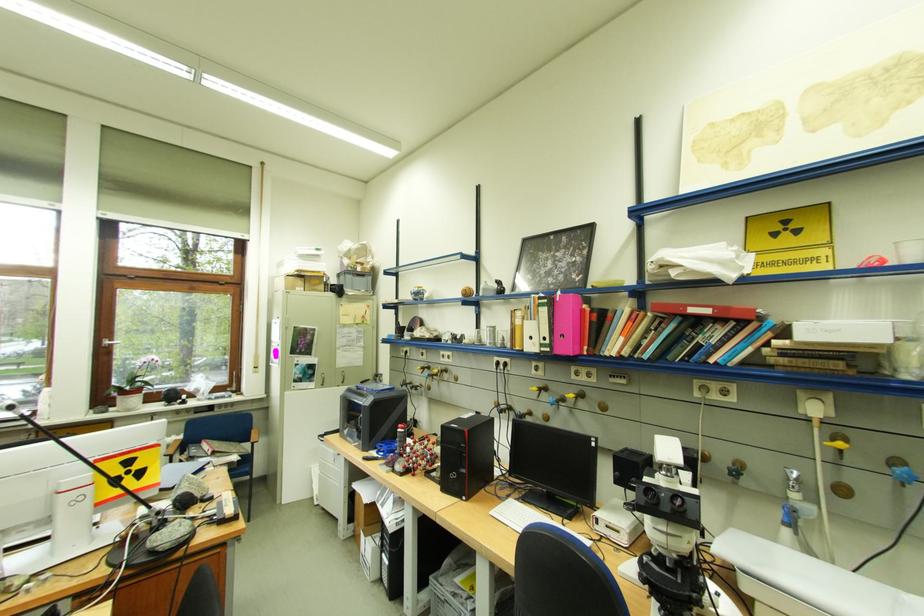
The location [665,523] corresponds to which object?

It corresponds to the molecular model in the image.